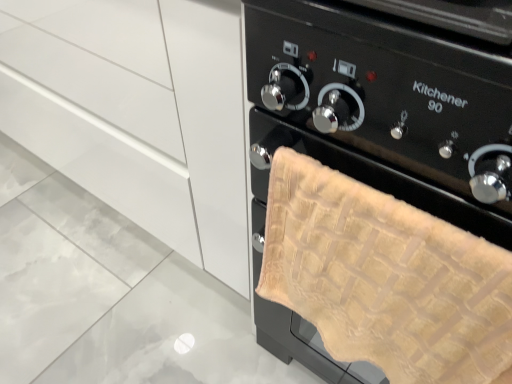
Question: Is beige textured towel at right not close to matte white cabinet at center?

Choices:
 (A) yes
 (B) no

Answer: (B)

Question: Is beige textured towel at right positioned beyond the bounds of matte white cabinet at center?

Choices:
 (A) yes
 (B) no

Answer: (A)

Question: Can you confirm if beige textured towel at right is thinner than matte white cabinet at center?

Choices:
 (A) no
 (B) yes

Answer: (B)

Question: From the image's perspective, is beige textured towel at right over matte white cabinet at center?

Choices:
 (A) no
 (B) yes

Answer: (A)

Question: Is beige textured towel at right oriented towards matte white cabinet at center?

Choices:
 (A) yes
 (B) no

Answer: (B)

Question: Is beige textured towel at right at the right side of matte white cabinet at center?

Choices:
 (A) no
 (B) yes

Answer: (B)

Question: Is the depth of matte white cabinet at center less than that of beige textured towel at right?

Choices:
 (A) yes
 (B) no

Answer: (B)

Question: From the image's perspective, is matte white cabinet at center located above beige textured towel at right?

Choices:
 (A) no
 (B) yes

Answer: (B)

Question: From a real-world perspective, does matte white cabinet at center sit lower than beige textured towel at right?

Choices:
 (A) yes
 (B) no

Answer: (A)

Question: Can you confirm if matte white cabinet at center is positioned to the right of beige textured towel at right?

Choices:
 (A) no
 (B) yes

Answer: (A)

Question: From a real-world perspective, is matte white cabinet at center physically above beige textured towel at right?

Choices:
 (A) yes
 (B) no

Answer: (B)

Question: Can you confirm if matte white cabinet at center is taller than beige textured towel at right?

Choices:
 (A) yes
 (B) no

Answer: (A)

Question: Is point (134, 51) closer or farther from the camera than point (371, 38)?

Choices:
 (A) farther
 (B) closer

Answer: (A)